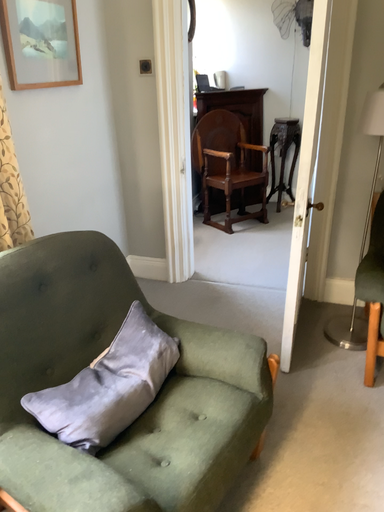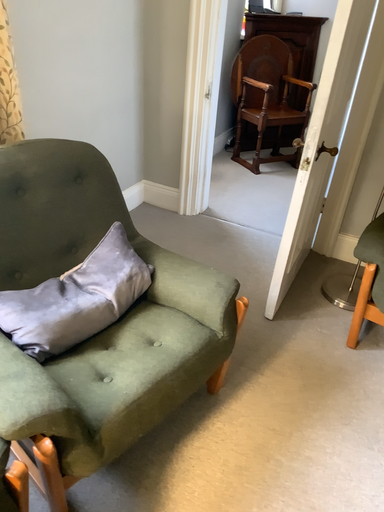
Question: How did the camera likely rotate when shooting the video?

Choices:
 (A) rotated downward
 (B) rotated upward

Answer: (A)